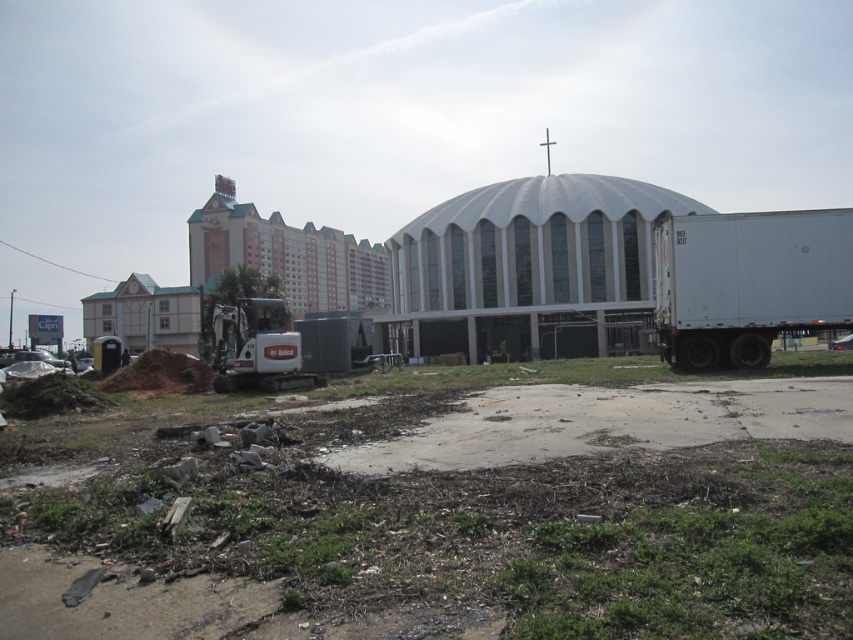
Is the position of dirt at lower left less distant than that of white matte trailer truck at right?

Yes, it is.

Can you confirm if dirt at lower left is positioned to the left of white matte trailer truck at right?

Indeed, dirt at lower left is positioned on the left side of white matte trailer truck at right.

Locate an element on the screen. The height and width of the screenshot is (640, 853). dirt at lower left is located at coordinates pos(440,524).

Does dirt at lower left appear on the right side of white matte trailer truck at lower left?

Indeed, dirt at lower left is positioned on the right side of white matte trailer truck at lower left.

Locate an element on the screen. dirt at lower left is located at coordinates (440, 524).

Between point (514, 536) and point (227, 346), which one is positioned behind?

The point (227, 346) is behind.

Locate an element on the screen. dirt at lower left is located at coordinates (440, 524).

Can you confirm if white matte trailer truck at right is taller than white matte trailer truck at lower left?

Correct, white matte trailer truck at right is much taller as white matte trailer truck at lower left.

Does white matte trailer truck at right appear under white matte trailer truck at lower left?

Incorrect, white matte trailer truck at right is not positioned below white matte trailer truck at lower left.

The width and height of the screenshot is (853, 640). Find the location of `white matte trailer truck at right`. white matte trailer truck at right is located at coordinates (747, 282).

You are a GUI agent. You are given a task and a screenshot of the screen. Output one action in this format:
    pyautogui.click(x=<x>, y=<y>)
    Task: Click on the white matte trailer truck at right
    This screenshot has height=640, width=853.
    Given the screenshot: What is the action you would take?
    pyautogui.click(x=747, y=282)